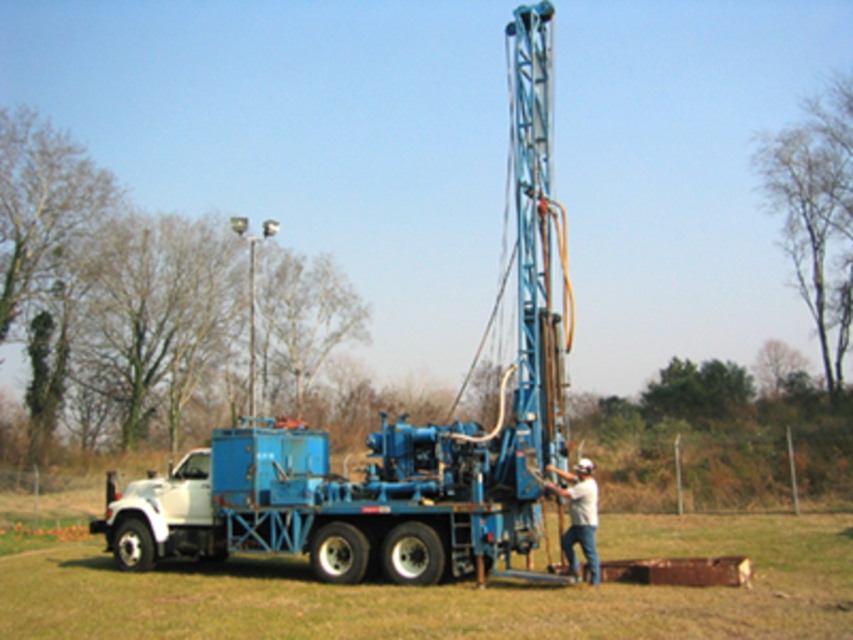
Question: Among these points, which one is farthest from the camera?

Choices:
 (A) (x=532, y=108)
 (B) (x=830, y=557)
 (C) (x=572, y=532)

Answer: (B)

Question: Is matte blue truck at center smaller than light beige fabric shirt at center?

Choices:
 (A) no
 (B) yes

Answer: (A)

Question: Does matte blue truck at center have a larger size compared to blue metallic truck at center?

Choices:
 (A) yes
 (B) no

Answer: (A)

Question: Which of the following is the closest to the observer?

Choices:
 (A) blue metallic truck at center
 (B) light beige fabric shirt at center
 (C) matte blue truck at center

Answer: (A)

Question: Considering the real-world distances, which object is closest to the matte blue truck at center?

Choices:
 (A) light beige fabric shirt at center
 (B) blue metallic truck at center

Answer: (B)

Question: Where is matte blue truck at center located in relation to light beige fabric shirt at center in the image?

Choices:
 (A) left
 (B) right

Answer: (A)